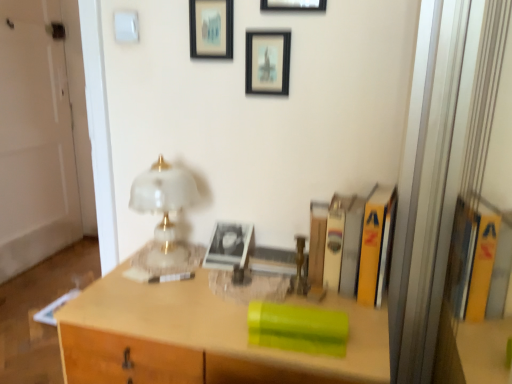
I want to click on vacant area that is in front of yellow hardcover book at right, which is counted as the 3th book, starting from the left, so click(x=366, y=321).